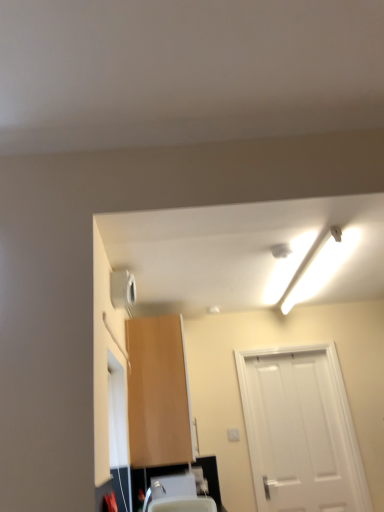
This screenshot has height=512, width=384. Find the location of `white fluorescent tube at upper right`. white fluorescent tube at upper right is located at coordinates (321, 266).

I want to click on white matte door at right, so click(x=300, y=431).

Image resolution: width=384 pixels, height=512 pixels. What do you see at coordinates (158, 392) in the screenshot?
I see `light brown wood cabinet at center` at bounding box center [158, 392].

I want to click on white fluorescent tube at upper right, so click(321, 266).

Where is `faucet in front of the white fluorescent tube at upper right`? This screenshot has height=512, width=384. faucet in front of the white fluorescent tube at upper right is located at coordinates (147, 499).

How different are the orientations of white fluorescent tube at upper right and satin nickel faucet at lower center in degrees?

There is a 92.4-degree angle between the facing directions of white fluorescent tube at upper right and satin nickel faucet at lower center.

Would you say white fluorescent tube at upper right contains satin nickel faucet at lower center?

No, satin nickel faucet at lower center is not surrounded by white fluorescent tube at upper right.

Considering the sizes of objects white fluorescent tube at upper right and satin nickel faucet at lower center in the image provided, who is smaller, white fluorescent tube at upper right or satin nickel faucet at lower center?

Smaller between the two is satin nickel faucet at lower center.

Which of these two, white fluorescent tube at upper right or light brown wood cabinet at center, is wider?

white fluorescent tube at upper right.

Considering the sizes of objects white fluorescent tube at upper right and light brown wood cabinet at center in the image provided, who is taller, white fluorescent tube at upper right or light brown wood cabinet at center?

light brown wood cabinet at center.

Is white fluorescent tube at upper right positioned with its back to light brown wood cabinet at center?

No.

Which object is further away from the camera taking this photo, white fluorescent tube at upper right or light brown wood cabinet at center?

light brown wood cabinet at center is more distant.

From the image's perspective, which one is positioned higher, satin nickel faucet at lower center or white fluorescent tube at upper right?

white fluorescent tube at upper right, from the image's perspective.

Is satin nickel faucet at lower center facing towards white fluorescent tube at upper right?

No, satin nickel faucet at lower center is not facing towards white fluorescent tube at upper right.

Is white plastic sink at lower center at the left side of light brown wood cabinet at center?

In fact, white plastic sink at lower center is to the right of light brown wood cabinet at center.

Which of these two, white plastic sink at lower center or light brown wood cabinet at center, stands shorter?

white plastic sink at lower center.

Is white plastic sink at lower center smaller than light brown wood cabinet at center?

Yes, white plastic sink at lower center is smaller than light brown wood cabinet at center.

Is satin nickel faucet at lower center positioned in front of white plastic sink at lower center?

That is True.

Is satin nickel faucet at lower center far from white plastic sink at lower center?

No, satin nickel faucet at lower center is not far away from white plastic sink at lower center.

From a real-world perspective, is satin nickel faucet at lower center below white plastic sink at lower center?

No, from a real-world perspective, satin nickel faucet at lower center is not beneath white plastic sink at lower center.

Consider the image. Is satin nickel faucet at lower center thinner than white plastic sink at lower center?

Correct, the width of satin nickel faucet at lower center is less than that of white plastic sink at lower center.

Looking at this image, is white matte door at right touching light brown wood cabinet at center?

No, white matte door at right is not making contact with light brown wood cabinet at center.

From the image's perspective, is white matte door at right located above or below light brown wood cabinet at center?

white matte door at right is below light brown wood cabinet at center.

Locate an element on the screen. Image resolution: width=384 pixels, height=512 pixels. cabinetry above the white matte door at right (from a real-world perspective) is located at coordinates (158, 392).

From a real-world perspective, between white matte door at right and light brown wood cabinet at center, who is vertically lower?

white matte door at right.

From a real-world perspective, is white matte door at right under white fluorescent tube at upper right?

Indeed, from a real-world perspective, white matte door at right is positioned beneath white fluorescent tube at upper right.

Is white matte door at right spatially inside white fluorescent tube at upper right, or outside of it?

white matte door at right exists outside the volume of white fluorescent tube at upper right.

Is white matte door at right taller than white fluorescent tube at upper right?

Yes.

How much distance is there between white matte door at right and white fluorescent tube at upper right?

white matte door at right is 38.85 inches away from white fluorescent tube at upper right.

I want to click on light fixture on the right of the satin nickel faucet at lower center, so click(321, 266).

Identify the location of light fixture that is in front of the light brown wood cabinet at center. The height and width of the screenshot is (512, 384). (321, 266).

Based on their spatial positions, is white fluorescent tube at upper right or light brown wood cabinet at center further from satin nickel faucet at lower center?

The object further to satin nickel faucet at lower center is white fluorescent tube at upper right.

When comparing their distances from satin nickel faucet at lower center, does white plastic sink at lower center or white fluorescent tube at upper right seem closer?

white plastic sink at lower center.

Estimate the real-world distances between objects in this image. Which object is closer to white plastic sink at lower center, white fluorescent tube at upper right or satin nickel faucet at lower center?

Among the two, satin nickel faucet at lower center is located nearer to white plastic sink at lower center.

Which object lies nearer to the anchor point white plastic sink at lower center, white fluorescent tube at upper right or white matte door at right?

white matte door at right.

Estimate the real-world distances between objects in this image. Which object is closer to white matte door at right, white plastic sink at lower center or light brown wood cabinet at center?

white plastic sink at lower center is closer to white matte door at right.

Based on their spatial positions, is white matte door at right or white plastic sink at lower center further from satin nickel faucet at lower center?

white matte door at right.

Considering their positions, is satin nickel faucet at lower center positioned closer to light brown wood cabinet at center than white fluorescent tube at upper right?

satin nickel faucet at lower center lies closer to light brown wood cabinet at center than the other object.

Looking at the image, which one is located closer to satin nickel faucet at lower center, white matte door at right or light brown wood cabinet at center?

light brown wood cabinet at center is positioned closer to the anchor satin nickel faucet at lower center.

This screenshot has height=512, width=384. I want to click on sink located between light brown wood cabinet at center and white matte door at right in the left-right direction, so click(x=179, y=493).

Locate an element on the screen. This screenshot has width=384, height=512. faucet between white fluorescent tube at upper right and white matte door at right vertically is located at coordinates (147, 499).

Where is `cabinetry between white fluorescent tube at upper right and white matte door at right in the vertical direction`? The image size is (384, 512). cabinetry between white fluorescent tube at upper right and white matte door at right in the vertical direction is located at coordinates pos(158,392).

Where is `door that lies between white fluorescent tube at upper right and white plastic sink at lower center from top to bottom`? This screenshot has height=512, width=384. door that lies between white fluorescent tube at upper right and white plastic sink at lower center from top to bottom is located at coordinates (300, 431).